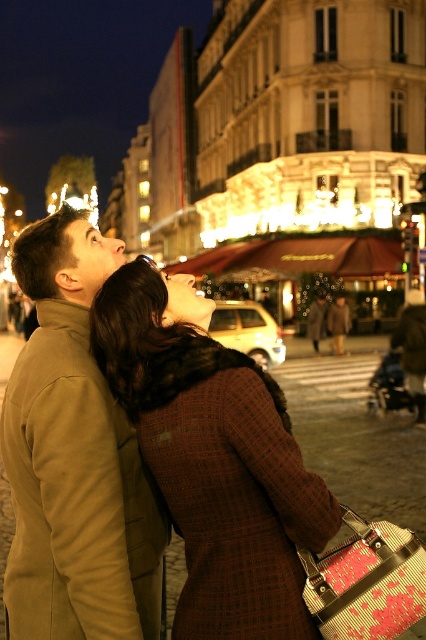
You are a photographer trying to capture a photo of both the plaid wool coat at center and the brown wool coat at center in the scene. Since you want to ensure both coats are visible in the frame, which coat should you focus on first to ensure the other is also in the shot?

The plaid wool coat at center is located below the brown wool coat at center. To capture both in the frame, focus on the brown wool coat at center first as it is higher up, ensuring the lower plaid wool coat at center will also be included.

You are a photographer trying to capture both the tan wool coat at left and the brown wool coat at center in a single shot. Since the camera can only focus on one subject at a time, which coat should you focus on to ensure the other is still in the frame?

The tan wool coat at left is in front of the brown wool coat at center, so focusing on the tan wool coat at left will keep both coats in the frame as the brown wool coat at center is behind it.

You are a tailor who needs to determine which coat requires more fabric for alterations. Based on the image, which coat between the tan wool coat at left and the brown wool coat at center would need more fabric due to its size?

The tan wool coat at left has a larger size compared to brown wool coat at center, so it would require more fabric for alterations.